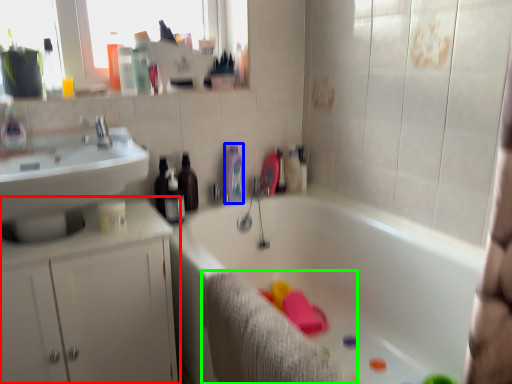
Question: Which object is the farthest from bathroom cabinet (highlighted by a red box)? Choose among these: toiletry (highlighted by a blue box) or bath towel (highlighted by a green box).

Choices:
 (A) toiletry
 (B) bath towel

Answer: (A)